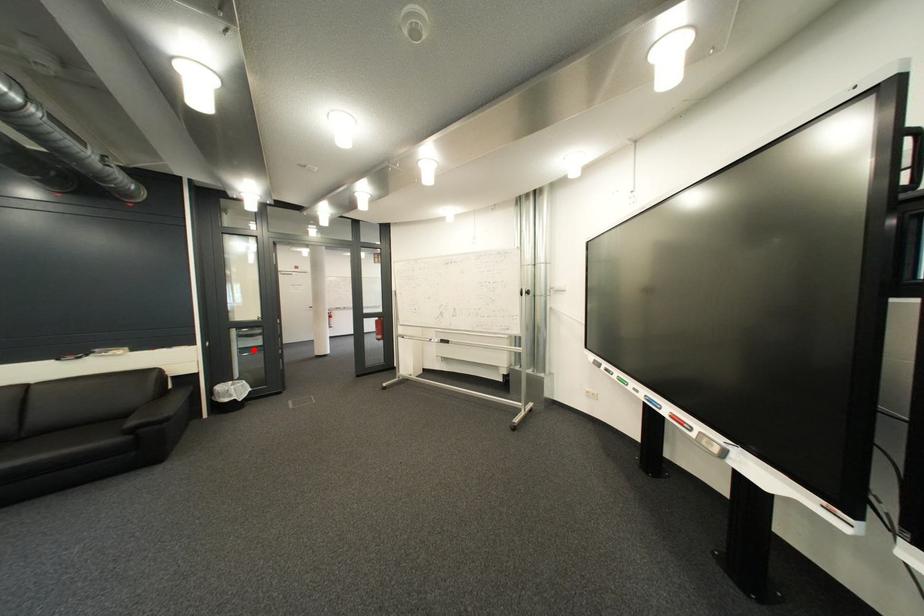
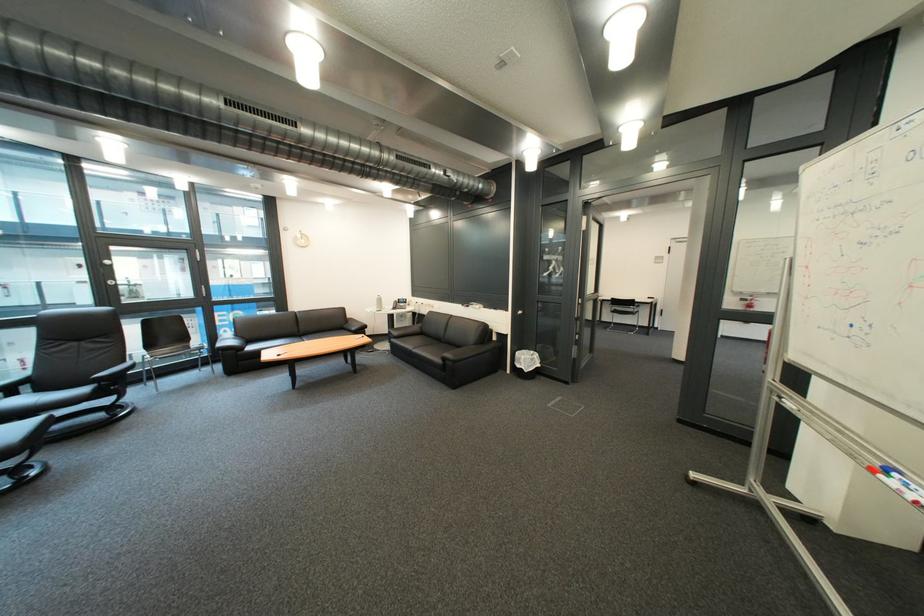
The point at the highlighted location is marked in the first image. Where is the corresponding point in the second image?

(628, 325)